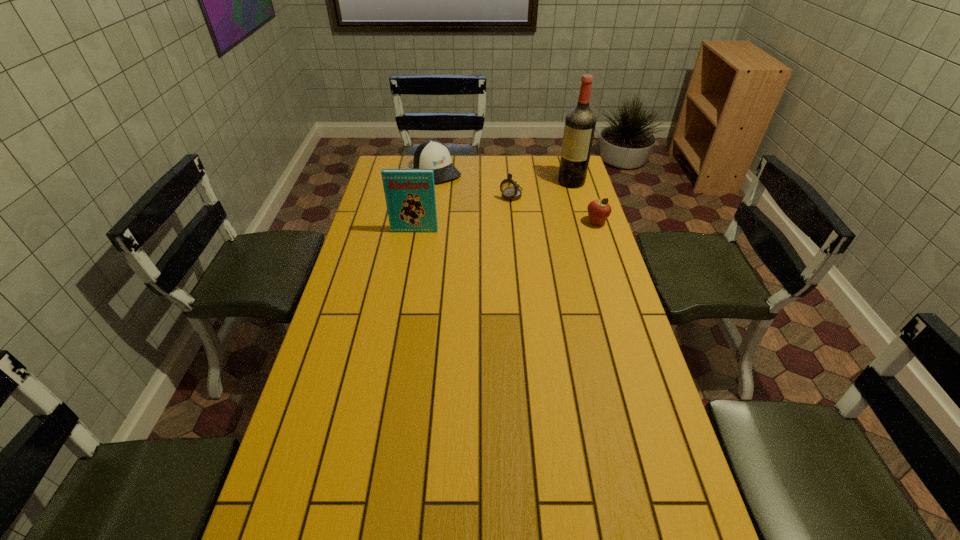
At what (x,y) coordinates should I click in order to perform the action: click on free point between the liquor and the cap. Please return your answer as a coordinate pair (x, y). Image resolution: width=960 pixels, height=540 pixels. Looking at the image, I should click on (504, 176).

Find the location of a particular element. empty space that is in between the cap and the tallest object is located at coordinates (504, 176).

Where is `vacant area that lies between the tallest object and the cap`? The width and height of the screenshot is (960, 540). vacant area that lies between the tallest object and the cap is located at coordinates (504, 176).

I want to click on free space between the third object from left to right and the cap, so click(x=474, y=183).

Find the location of `vacant area between the apple and the tallest object`. vacant area between the apple and the tallest object is located at coordinates (584, 202).

You are a GUI agent. You are given a task and a screenshot of the screen. Output one action in this format:
    pyautogui.click(x=<x>, y=<y>)
    Task: Click on the vacant area that lies between the liquor and the second tallest object
    Image resolution: width=960 pixels, height=540 pixels.
    Given the screenshot: What is the action you would take?
    pyautogui.click(x=492, y=206)

Where is `free space that is in between the apple and the liquor`? free space that is in between the apple and the liquor is located at coordinates (584, 202).

Select which object appears as the closest to the apple. Please provide its 2D coordinates. Your answer should be formatted as a tuple, i.e. [(x, y)], where the tuple contains the x and y coordinates of a point satisfying the conditions above.

[(580, 122)]

Locate which object ranks second in proximity to the book. Please provide its 2D coordinates. Your answer should be formatted as a tuple, i.e. [(x, y)], where the tuple contains the x and y coordinates of a point satisfying the conditions above.

[(432, 154)]

Identify the location of free space that satisfies the following two spatial constraints: 1. on the front side of the cap; 2. on the left side of the apple. (430, 223).